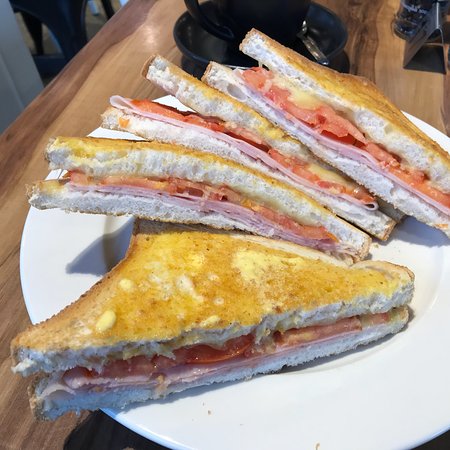
Locate an element on the screen. This screenshot has height=450, width=450. silver spoon is located at coordinates coord(305,38).